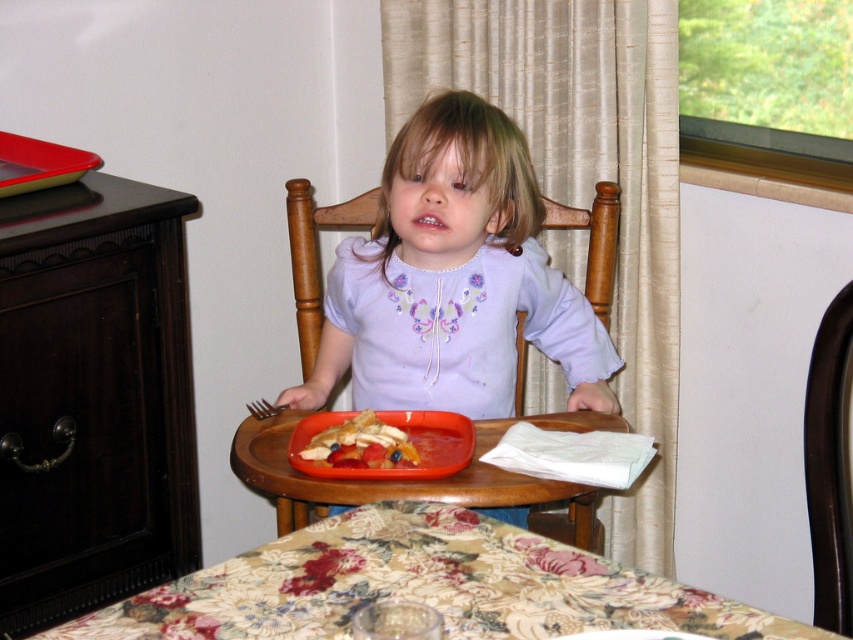
The dark wood dresser at left is 1.36 meters away from the child. If the child wants to reach the dresser, will they need to leave their seat?

The dark wood dresser at left is 1.36 meters away from the child. Since the distance is greater than the typical reach of a child from their seat, the child would need to leave their seat to reach it.

Looking at this image, you are a parent trying to place a small toy on the table between the wooden chair at center and the smooth plastic tray at center. Which object should you move closer to the edge of the table to make space?

You should move the smooth plastic tray at center closer to the edge of the table because the wooden chair at center is closer to you, making it harder to access the space between them. Moving the tray would create more space near the edge.